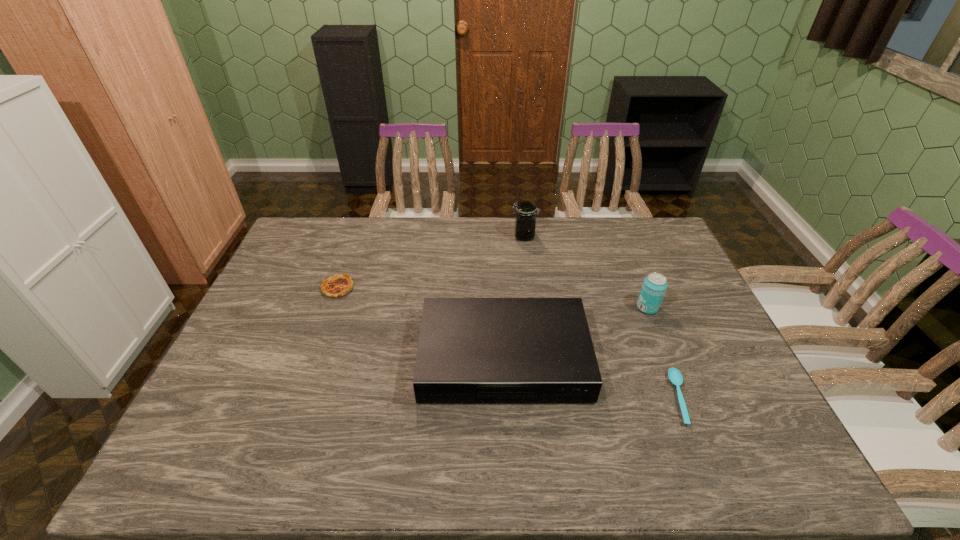
Locate an element on the screen. free space located 0.120m at the front of the third tallest object for disc insertion is located at coordinates (509, 453).

Identify the location of free space located on the front of the quiche. This screenshot has width=960, height=540. (x=318, y=344).

Find the location of `free space located on the left of the shortest object`. free space located on the left of the shortest object is located at coordinates (607, 397).

The width and height of the screenshot is (960, 540). What are the coordinates of `object positioned at the far edge` in the screenshot? It's located at (525, 219).

At what (x,y) coordinates should I click in order to perform the action: click on object present at the right edge. Please return your answer as a coordinate pair (x, y). The image size is (960, 540). Looking at the image, I should click on (654, 286).

This screenshot has height=540, width=960. In order to click on vacant region at the far edge in this screenshot , I will do `click(422, 241)`.

The width and height of the screenshot is (960, 540). In order to click on free space at the near edge of the desktop in this screenshot , I will do `click(588, 453)`.

Image resolution: width=960 pixels, height=540 pixels. In order to click on free spot at the left edge of the desktop in this screenshot , I will do `click(202, 414)`.

In the image, there is a desktop. At what (x,y) coordinates should I click in order to perform the action: click on vacant space at the right edge. Please return your answer as a coordinate pair (x, y). Looking at the image, I should click on (703, 382).

In the image, there is a desktop. Identify the location of free space at the far left corner. Image resolution: width=960 pixels, height=540 pixels. (323, 245).